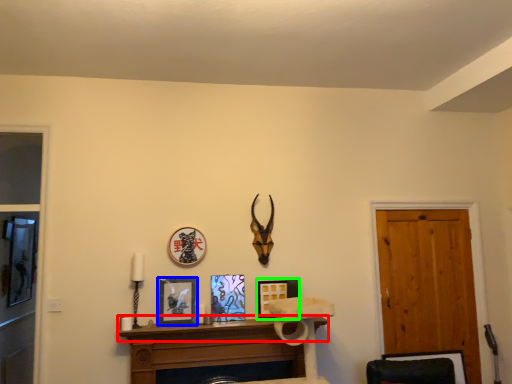
Question: Based on their relative distances, which object is nearer to mantle (highlighted by a red box)? Choose from picture frame (highlighted by a blue box) and picture frame (highlighted by a green box).

Choices:
 (A) picture frame
 (B) picture frame

Answer: (A)